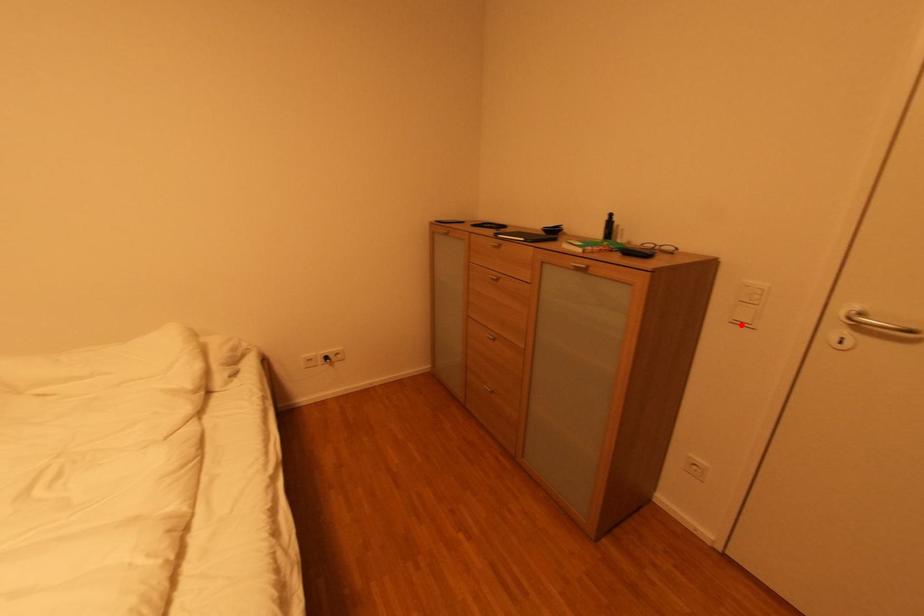
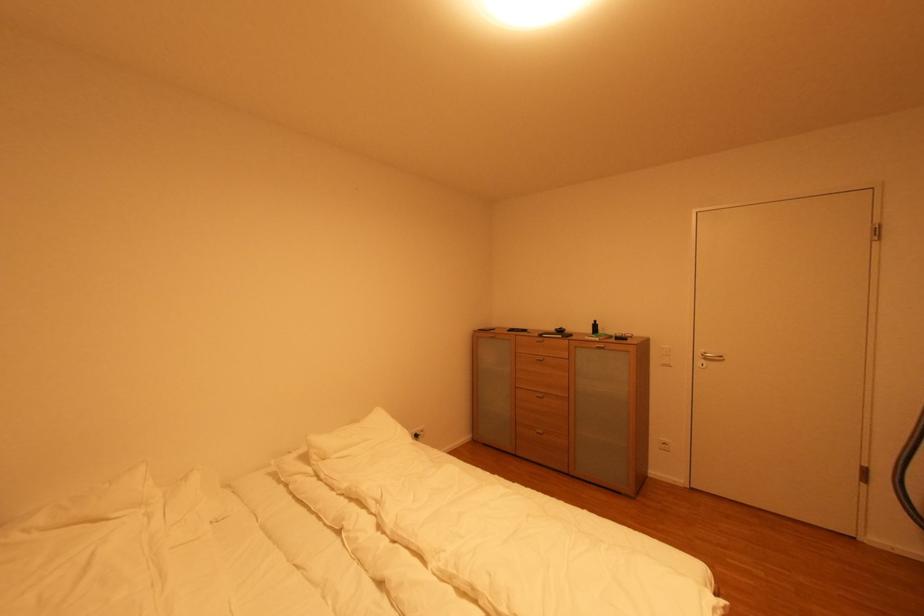
The point at the highlighted location is marked in the first image. Where is the corresponding point in the second image?

(670, 367)